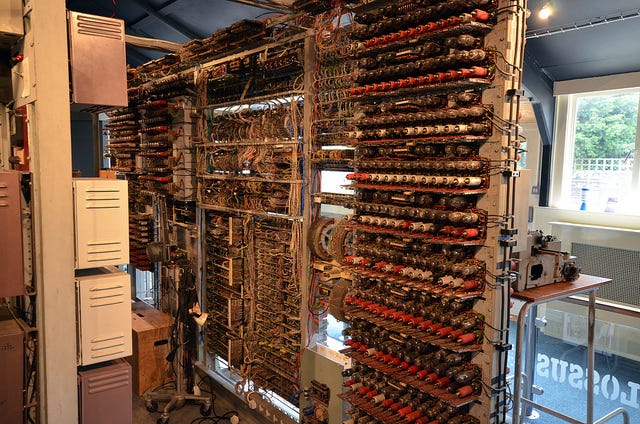
Locate an element on the screen. electric panels is located at coordinates (93, 236), (6, 237), (109, 319), (8, 366), (86, 387).